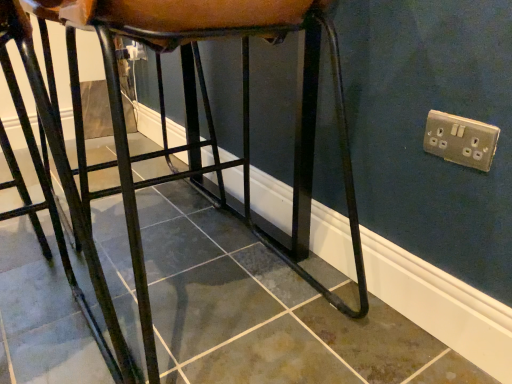
Question: Is point (112, 304) closer or farther from the camera than point (440, 117)?

Choices:
 (A) closer
 (B) farther

Answer: (B)

Question: In the image, is matte black stool at center on the left side or the right side of silver metallic socket at upper right?

Choices:
 (A) left
 (B) right

Answer: (A)

Question: From their relative heights in the image, would you say matte black stool at center is taller or shorter than silver metallic socket at upper right?

Choices:
 (A) tall
 (B) short

Answer: (A)

Question: Considering the positions of silver metallic socket at upper right and matte black stool at center in the image, is silver metallic socket at upper right bigger or smaller than matte black stool at center?

Choices:
 (A) small
 (B) big

Answer: (A)

Question: Would you say silver metallic socket at upper right is inside or outside matte black stool at center?

Choices:
 (A) outside
 (B) inside

Answer: (A)

Question: Considering the relative positions of silver metallic socket at upper right and matte black stool at center in the image provided, is silver metallic socket at upper right to the left or to the right of matte black stool at center?

Choices:
 (A) right
 (B) left

Answer: (A)

Question: In terms of height, does silver metallic socket at upper right look taller or shorter compared to matte black stool at center?

Choices:
 (A) short
 (B) tall

Answer: (A)